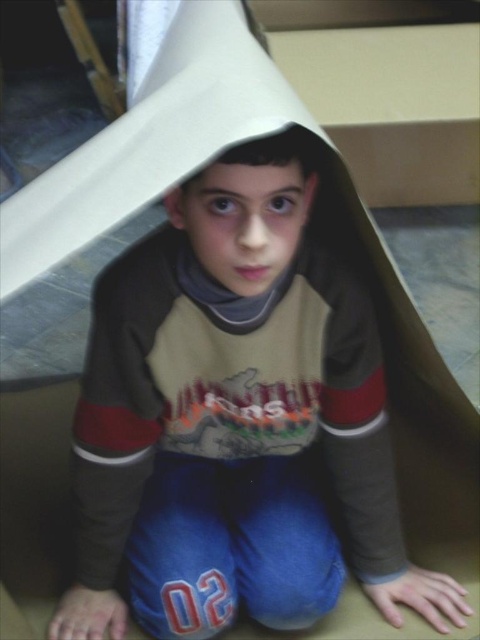
Between matte brown hoodie at center and matte brown paper bag at center, which one is positioned higher?

matte brown paper bag at center is higher up.

Is point (164, 412) positioned after point (238, 179)?

That is True.

Which is behind, point (157, 372) or point (224, 196)?

Positioned behind is point (157, 372).

At what (x,y) coordinates should I click in order to perform the action: click on matte brown hoodie at center. Please return your answer as a coordinate pair (x, y). The width and height of the screenshot is (480, 640). Looking at the image, I should click on (236, 419).